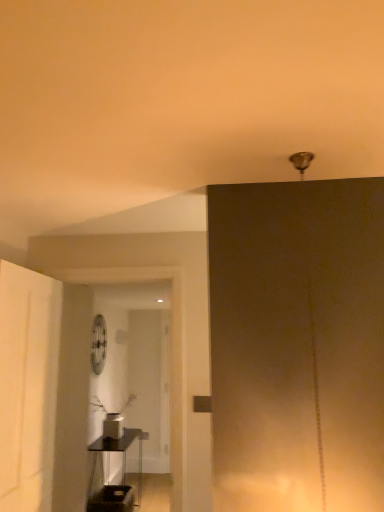
Question: From a real-world perspective, relative to metallic circular fan at center, is metallic black shelf at lower left vertically above or below?

Choices:
 (A) below
 (B) above

Answer: (A)

Question: Is point (122, 440) positioned closer to the camera than point (94, 349)?

Choices:
 (A) farther
 (B) closer

Answer: (A)

Question: In terms of height, does metallic black shelf at lower left look taller or shorter compared to metallic circular fan at center?

Choices:
 (A) short
 (B) tall

Answer: (B)

Question: From the image's perspective, is metallic circular fan at center positioned above or below metallic black shelf at lower left?

Choices:
 (A) below
 (B) above

Answer: (B)

Question: Considering the positions of metallic circular fan at center and metallic black shelf at lower left in the image, is metallic circular fan at center wider or thinner than metallic black shelf at lower left?

Choices:
 (A) wide
 (B) thin

Answer: (B)

Question: Is metallic circular fan at center bigger or smaller than metallic black shelf at lower left?

Choices:
 (A) big
 (B) small

Answer: (B)

Question: Which is correct: metallic circular fan at center is inside metallic black shelf at lower left, or outside of it?

Choices:
 (A) outside
 (B) inside

Answer: (A)